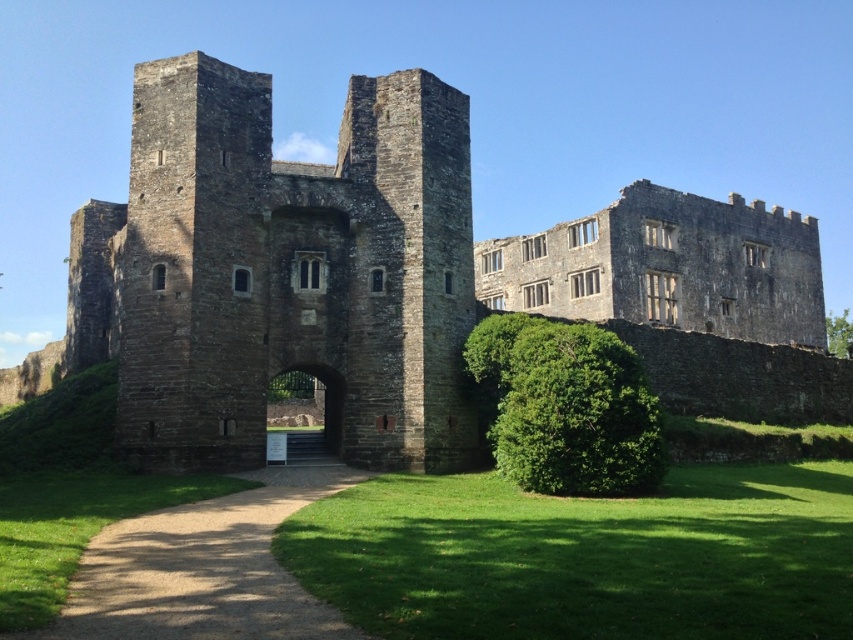
You are an architect visiting a historic site. You observe the brown stone castle at center and the green leafy hedge at center. Which of these two objects would you estimate to be bigger in terms of physical size?

The brown stone castle at center is larger in size than the green leafy hedge at center, so the castle is bigger.

You are standing at the entrance of the historic stone structure and want to walk along the path to the garden. Is the brown gravel path at center long enough to reach the green leafy hedge at center?

The brown gravel path at center is shorter than the green leafy hedge at center, so it is not long enough to reach the hedge.